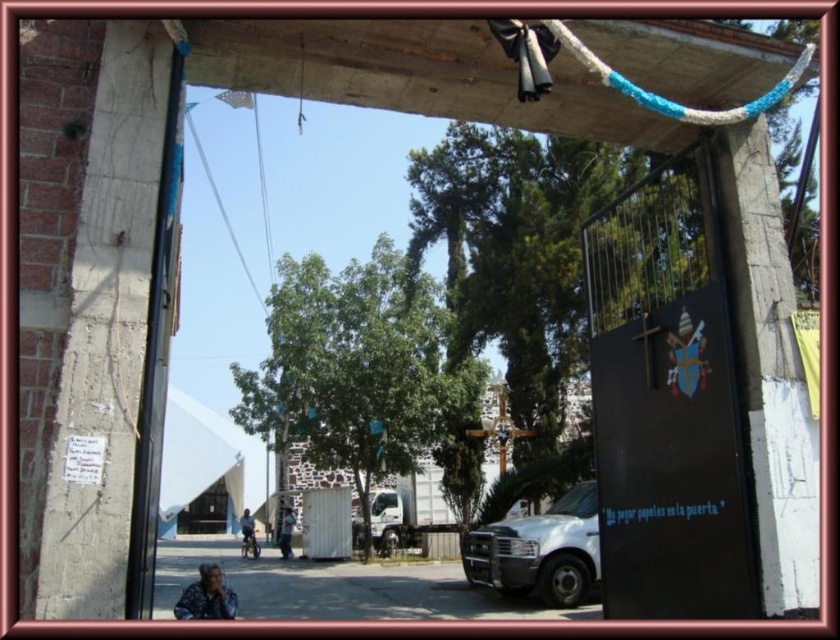
Question: Among these points, which one is nearest to the camera?

Choices:
 (A) (563, 534)
 (B) (662, 106)

Answer: (B)

Question: Does white matte van at lower right have a smaller size compared to blue braided rope at upper center?

Choices:
 (A) no
 (B) yes

Answer: (A)

Question: Does white matte van at lower right come in front of blue braided rope at upper center?

Choices:
 (A) yes
 (B) no

Answer: (B)

Question: Among these points, which one is nearest to the camera?

Choices:
 (A) (460, 541)
 (B) (746, 102)

Answer: (B)

Question: Can you confirm if white matte van at lower right is positioned to the left of blue braided rope at upper center?

Choices:
 (A) yes
 (B) no

Answer: (B)

Question: Which object appears farthest from the camera in this image?

Choices:
 (A) blue braided rope at upper center
 (B) white matte van at lower right

Answer: (B)